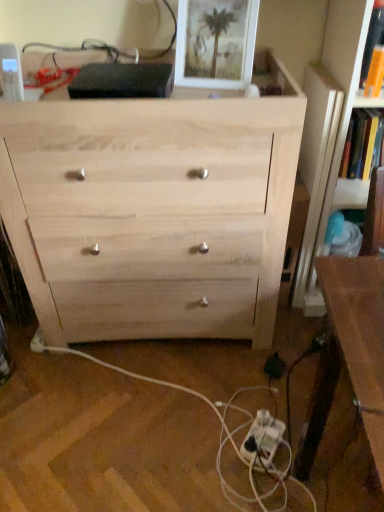
Identify the location of free spot to the left of white plastic extension cord at lower center. This screenshot has width=384, height=512. (208, 442).